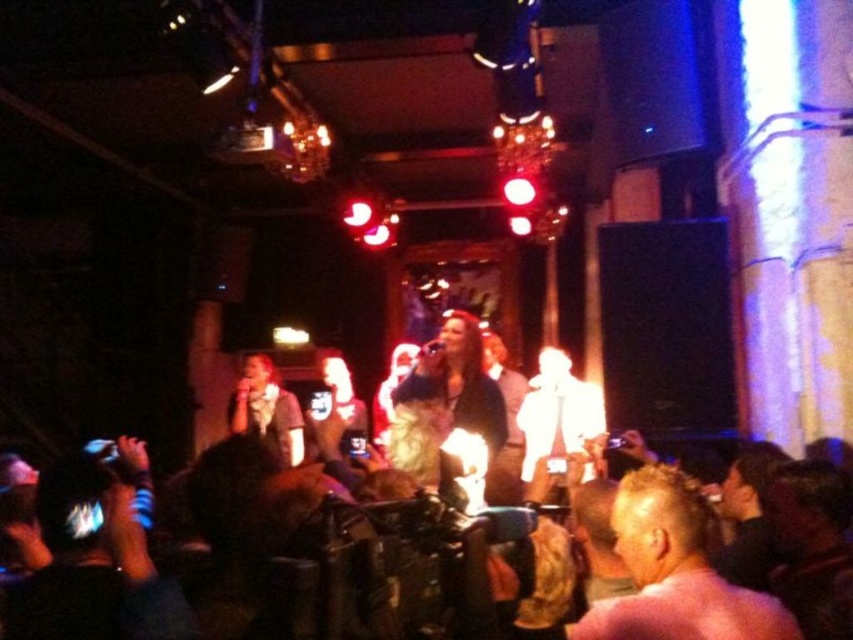
Question: Based on their relative distances, which object is farther from the shiny gold jacket at center?

Choices:
 (A) white glossy microphone at center
 (B) pink matte hair at center

Answer: (A)

Question: Which object is the closest to the shiny gold jacket at center?

Choices:
 (A) matte gray shirt at center
 (B) white glossy microphone at center
 (C) pink matte hair at center

Answer: (C)

Question: Can you confirm if shiny gold jacket at center is positioned above matte gray shirt at center?

Choices:
 (A) no
 (B) yes

Answer: (B)

Question: Does pink matte hair at center come behind matte gray shirt at center?

Choices:
 (A) yes
 (B) no

Answer: (B)

Question: Which object is the farthest from the white glossy microphone at center?

Choices:
 (A) pink matte hair at center
 (B) shiny gold jacket at center
 (C) matte gray shirt at center

Answer: (A)

Question: Is shiny gold jacket at center below white glossy microphone at center?

Choices:
 (A) yes
 (B) no

Answer: (B)